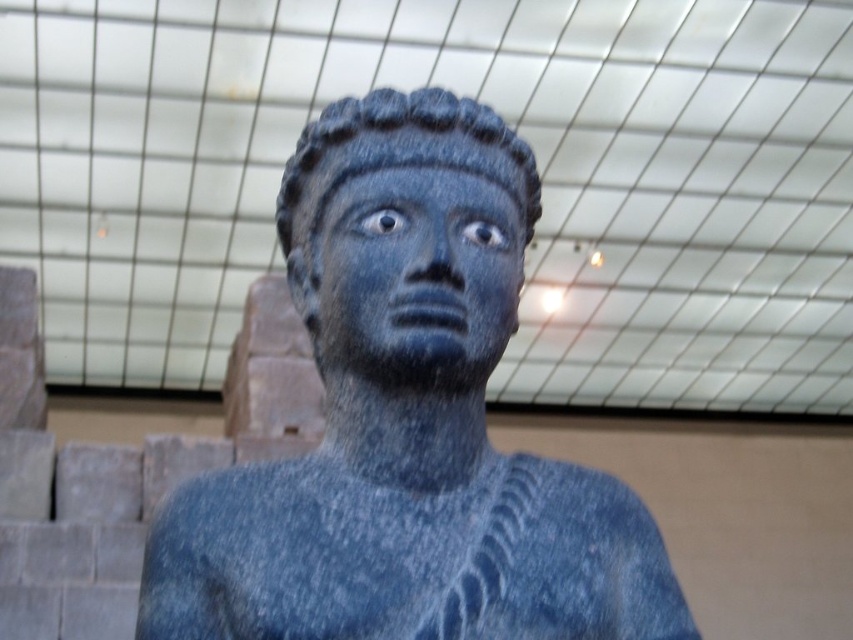
You are an art conservator examining the slate stone statue at center and the matte stone face at center. Which part of the statue is closer to you?

The slate stone statue at center is closer to you than the matte stone face at center, so the slate stone statue at center is the part closer to you.

You are an archaeologist examining the slate stone statue at center and the matte stone face at center. Which object has a greater width according to the description?

The description states that the slate stone statue at center might be wider than matte stone face at center, so the slate stone statue at center likely has a greater width.

You are a photographer taking a close up shot of the statue. You notice two points on the statue marked as point 1 at (247, 486) and point 2 at (448, 285). Which point is closer to your camera lens?

Point 1 at (247, 486) is closer to the camera lens than point 2 at (448, 285) because it is further to the camera than the other point.